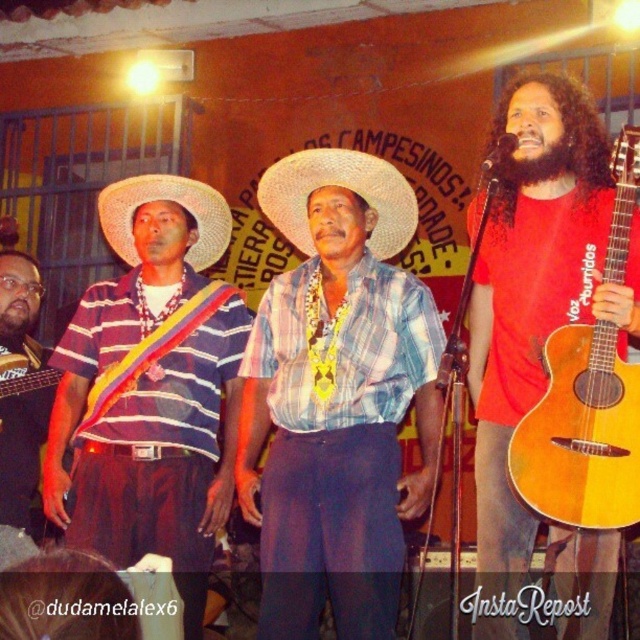
Which is in front, point (301, 172) or point (45, 426)?

Point (301, 172) is more forward.

Does white straw hat at center have a smaller size compared to striped fabric shirt at left?

Yes, white straw hat at center is smaller than striped fabric shirt at left.

This screenshot has width=640, height=640. I want to click on white straw hat at center, so click(x=342, y=188).

Is white straw hat at center wider than strawhat at left?

Yes.

Does white straw hat at center appear on the left side of strawhat at left?

No, white straw hat at center is not to the left of strawhat at left.

Which is in front, point (276, 228) or point (184, 186)?

Point (184, 186)

This screenshot has width=640, height=640. Find the location of `white straw hat at center`. white straw hat at center is located at coordinates (342, 188).

Can you confirm if striped fabric shirt at center is thinner than dark brown curly beard at upper right?

No.

Can you confirm if striped fabric shirt at center is positioned below dark brown curly beard at upper right?

Yes.

You are a GUI agent. You are given a task and a screenshot of the screen. Output one action in this format:
    pyautogui.click(x=<x>, y=<y>)
    Task: Click on the striped fabric shirt at center
    Image resolution: width=640 pixels, height=640 pixels.
    Given the screenshot: What is the action you would take?
    pyautogui.click(x=150, y=388)